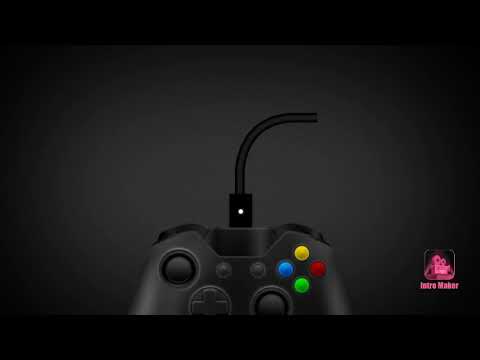
Image resolution: width=480 pixels, height=360 pixels. I want to click on xbox game controller graphic, so click(334, 298).